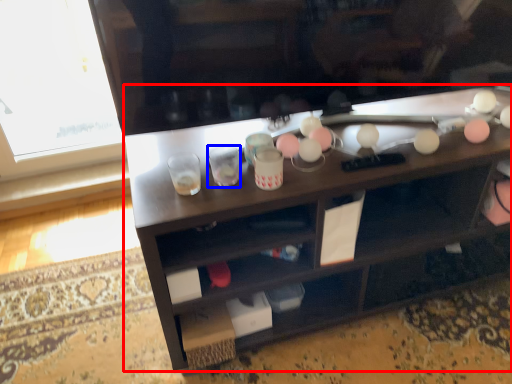
Question: Which of the following is the farthest to the observer, desk (highlighted by a red box) or shot glass (highlighted by a blue box)?

Choices:
 (A) desk
 (B) shot glass

Answer: (B)